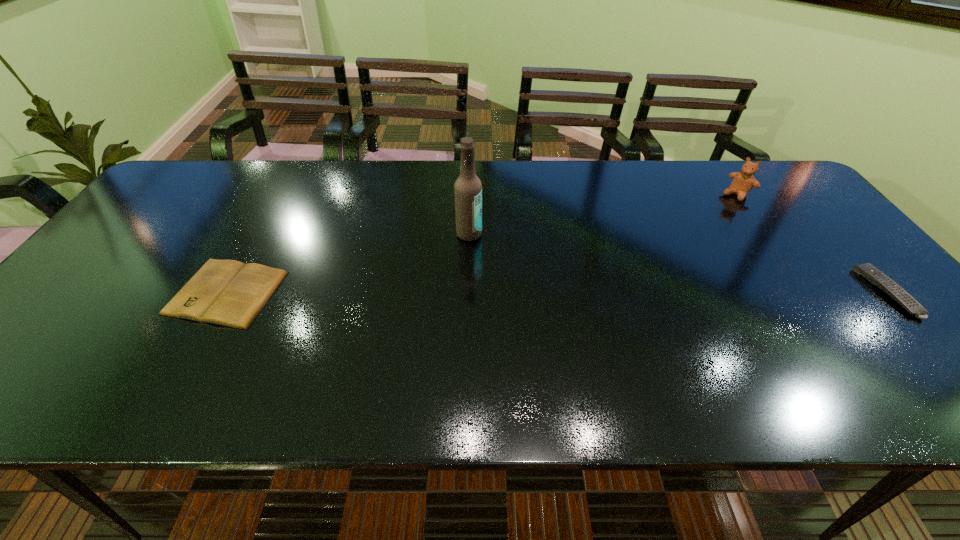
Image resolution: width=960 pixels, height=540 pixels. What are the coordinates of `book` in the screenshot? It's located at (226, 292).

This screenshot has height=540, width=960. What are the coordinates of `the rightmost object` in the screenshot? It's located at (868, 271).

Identify the location of the tallest object. This screenshot has width=960, height=540. (468, 188).

You are a GUI agent. You are given a task and a screenshot of the screen. Output one action in this format:
    pyautogui.click(x=<x>, y=<y>)
    Task: Click on the beer bottle
    The image size is (960, 540).
    Given the screenshot: What is the action you would take?
    click(468, 188)

Locate an element on the screen. the farthest object is located at coordinates (743, 182).

Identify the location of the third object from left to right. pos(743,182).

The width and height of the screenshot is (960, 540). Identify the location of free spot located 0.180m on the back of the leftmost object. (268, 218).

I want to click on vacant space positioned 0.100m on the back of the remote control, so click(x=841, y=241).

Where is `vacant space located on the side of the second farthest object with the label`? The image size is (960, 540). vacant space located on the side of the second farthest object with the label is located at coordinates (512, 279).

The image size is (960, 540). In order to click on vacant space located 0.400m on the side of the second farthest object with the label in this screenshot , I will do `click(572, 344)`.